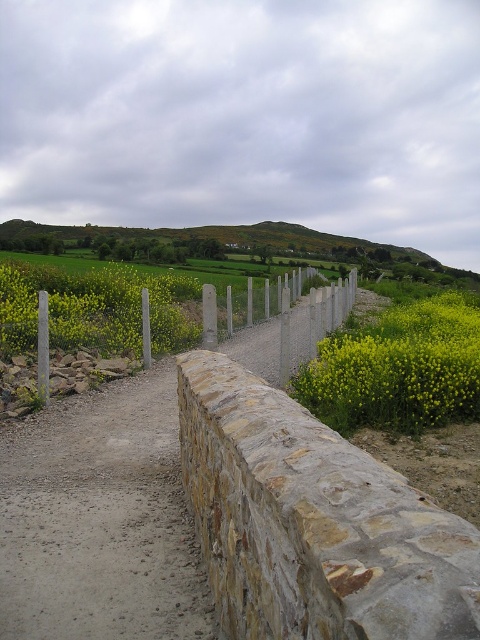
Looking at this image, between dusty gravel path at center and metallic chain-link fence at center, which one is positioned lower?

Positioned lower is dusty gravel path at center.

Which is more to the right, dusty gravel path at center or metallic chain-link fence at center?

From the viewer's perspective, metallic chain-link fence at center appears more on the right side.

Image resolution: width=480 pixels, height=640 pixels. Describe the element at coordinates (99, 520) in the screenshot. I see `dusty gravel path at center` at that location.

This screenshot has width=480, height=640. Find the location of `dusty gravel path at center`. dusty gravel path at center is located at coordinates (99, 520).

Is the position of stone textured wall at center less distant than that of dusty gravel path at center?

Yes, stone textured wall at center is closer to the viewer.

Is point (96, 502) positioned in front of point (11, 625)?

No, it is behind (11, 625).

Is point (173, 563) closer to camera compared to point (103, 476)?

That is True.

Identify the location of stone textured wall at center. (99, 520).

Does stone wall at center appear on the left side of yellow matte flowers at center?

Correct, you'll find stone wall at center to the left of yellow matte flowers at center.

Is stone wall at center positioned at the back of yellow matte flowers at center?

That is False.

Who is more forward, (232,557) or (313,380)?

Point (232,557)

Where is `stone wall at center`? This screenshot has width=480, height=640. stone wall at center is located at coordinates (312, 522).